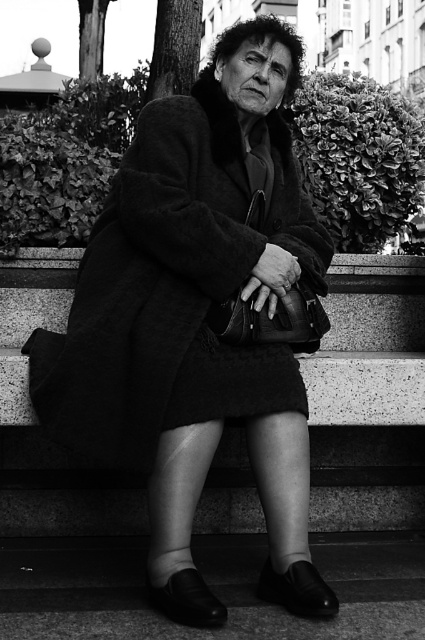
Which is in front, point (302, 339) or point (206, 492)?

Point (302, 339) is in front.

Describe the element at coordinates (198, 317) in the screenshot. I see `fuzzy wool coat at center` at that location.

Identify the location of fuzzy wool coat at center. This screenshot has height=640, width=425. (198, 317).